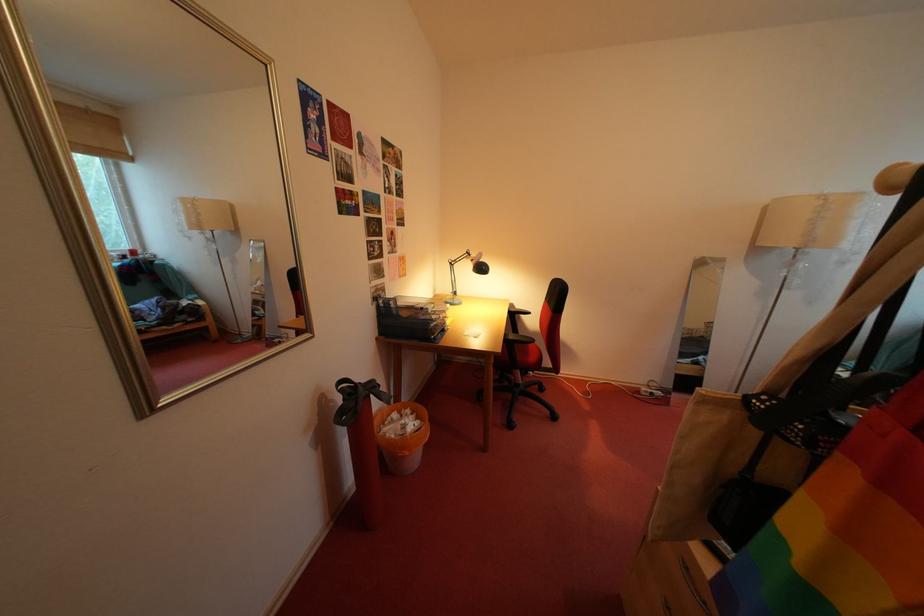
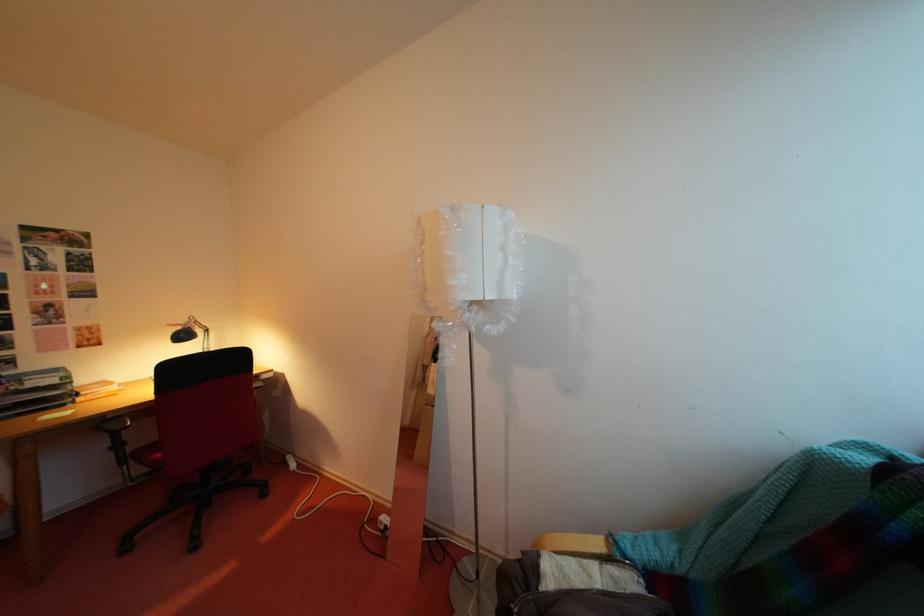
Question: Which direction would the cameraman need to move to produce the second image? Reply with the corresponding letter.

Choices:
 (A) Left
 (B) Right
 (C) Forward
 (D) Backward

Answer: (B)